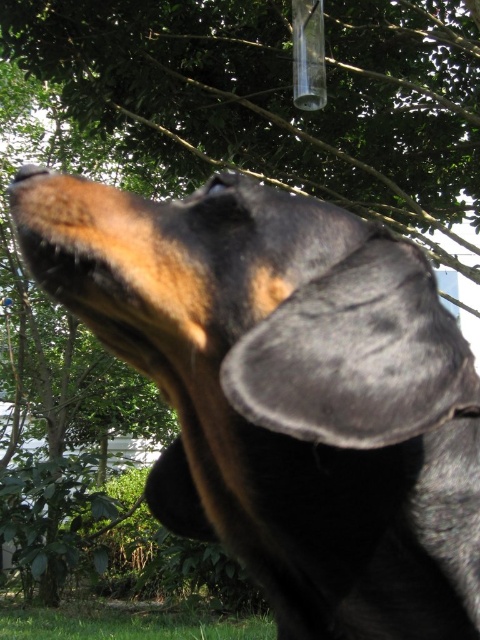
From the picture: You are a photographer trying to capture a portrait of the black fur dog at center. The green grass at lower center is blocking part of the dog. Can you adjust your position to ensure the dog takes up more of the frame without moving the dog?

The black fur dog at center is narrower than the green grass at lower center. By moving closer to the dog while keeping it centered, you can fill the frame with the dog and minimize the grass in the lower center.

In the scene shown: You are a photographer aiming to capture the black fur dog at center against the green grass at lower center. Based on their positions, will the dog be visible against the grass background?

Yes, the black fur dog at center is in front of green grass at lower center, so the dog will be visible against the grass background because it is positioned in front of it.

You are a photographer trying to capture the dog in the image. The dog is positioned at the center with its black fur. You want to place a sticker exactly at the point marked by the coordinates point [286,392]. Where should you place the sticker on the dog?

The point [286,392] corresponds to the black fur dog at center, so you should place the sticker on the dog at its center position.